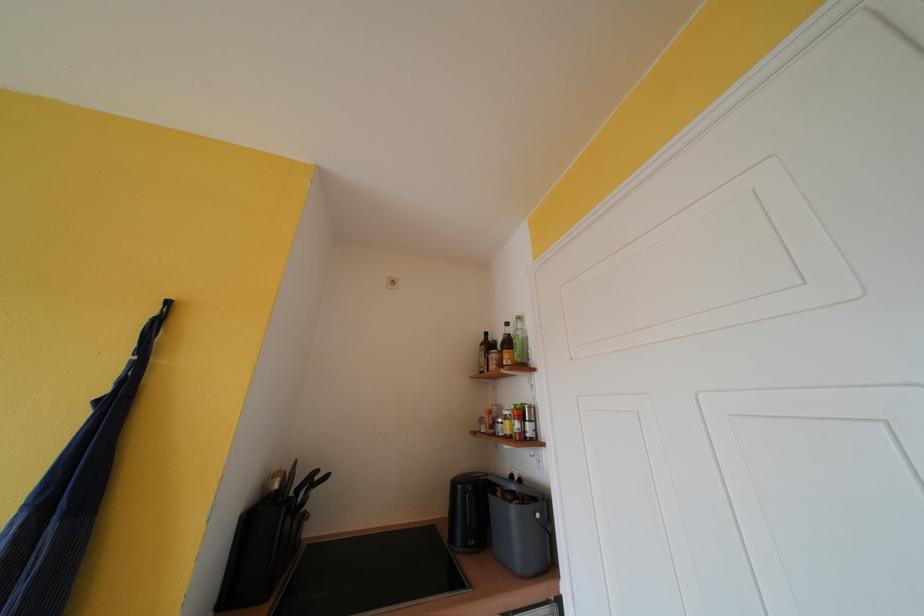
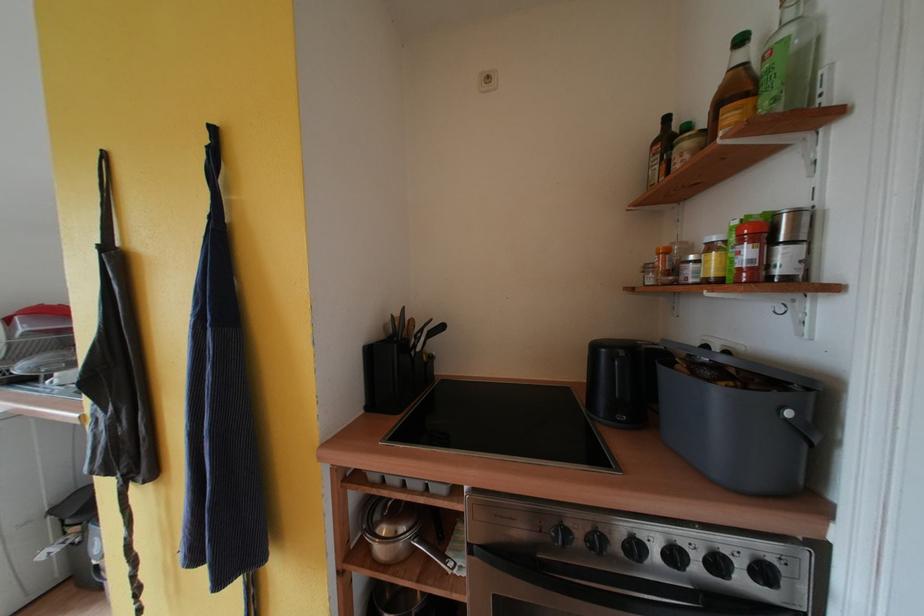
Where in the second image is the point corresponding to (x=514, y=328) from the first image?

(748, 44)